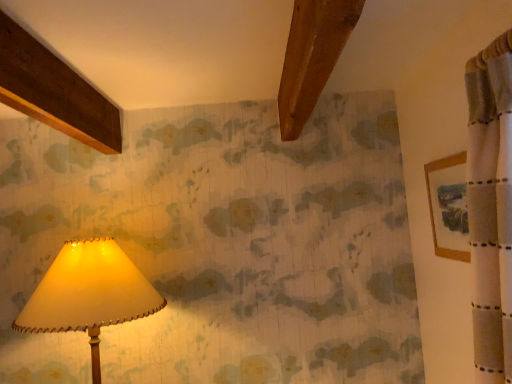
Question: Considering the relative sizes of matte cream lampshade at lower left and wooden framed picture at right in the image provided, is matte cream lampshade at lower left bigger than wooden framed picture at right?

Choices:
 (A) no
 (B) yes

Answer: (B)

Question: From the image's perspective, does matte cream lampshade at lower left appear lower than wooden framed picture at right?

Choices:
 (A) yes
 (B) no

Answer: (A)

Question: Is matte cream lampshade at lower left at the left side of wooden framed picture at right?

Choices:
 (A) yes
 (B) no

Answer: (A)

Question: Is matte cream lampshade at lower left next to wooden framed picture at right and touching it?

Choices:
 (A) yes
 (B) no

Answer: (B)

Question: Is wooden framed picture at right located within matte cream lampshade at lower left?

Choices:
 (A) no
 (B) yes

Answer: (A)

Question: From the image's perspective, does matte cream lampshade at lower left appear higher than wooden framed picture at right?

Choices:
 (A) yes
 (B) no

Answer: (B)

Question: Could you tell me if wooden framed picture at right is facing matte cream lampshade at lower left?

Choices:
 (A) no
 (B) yes

Answer: (B)

Question: Considering the relative sizes of wooden framed picture at right and matte cream lampshade at lower left in the image provided, is wooden framed picture at right shorter than matte cream lampshade at lower left?

Choices:
 (A) no
 (B) yes

Answer: (B)

Question: From the image's perspective, would you say wooden framed picture at right is shown under matte cream lampshade at lower left?

Choices:
 (A) yes
 (B) no

Answer: (B)

Question: Is wooden framed picture at right not close to matte cream lampshade at lower left?

Choices:
 (A) yes
 (B) no

Answer: (A)

Question: Considering the relative sizes of wooden framed picture at right and matte cream lampshade at lower left in the image provided, is wooden framed picture at right wider than matte cream lampshade at lower left?

Choices:
 (A) no
 (B) yes

Answer: (A)

Question: From a real-world perspective, is wooden framed picture at right on matte cream lampshade at lower left?

Choices:
 (A) no
 (B) yes

Answer: (B)

Question: Considering the positions of point (460, 190) and point (113, 291), is point (460, 190) closer or farther from the camera than point (113, 291)?

Choices:
 (A) farther
 (B) closer

Answer: (B)